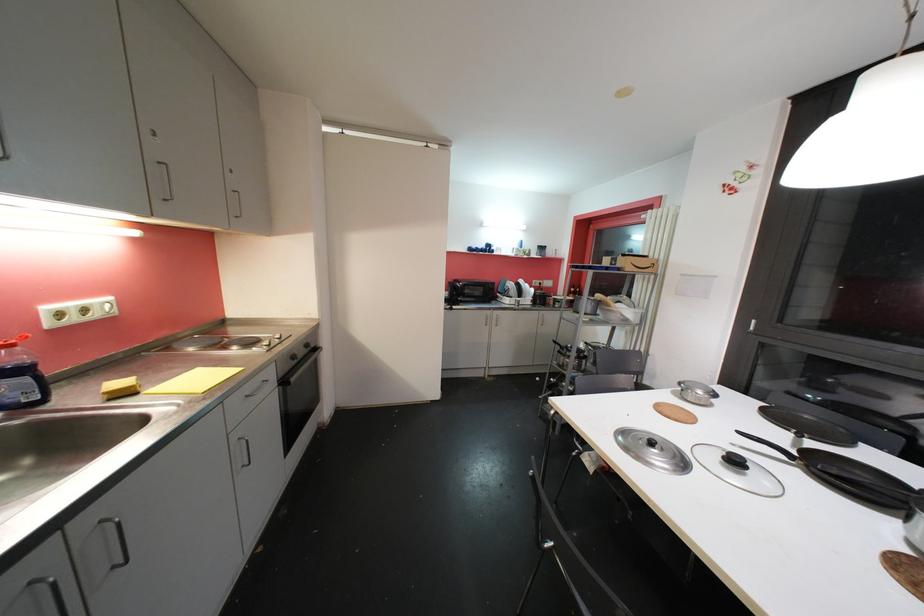
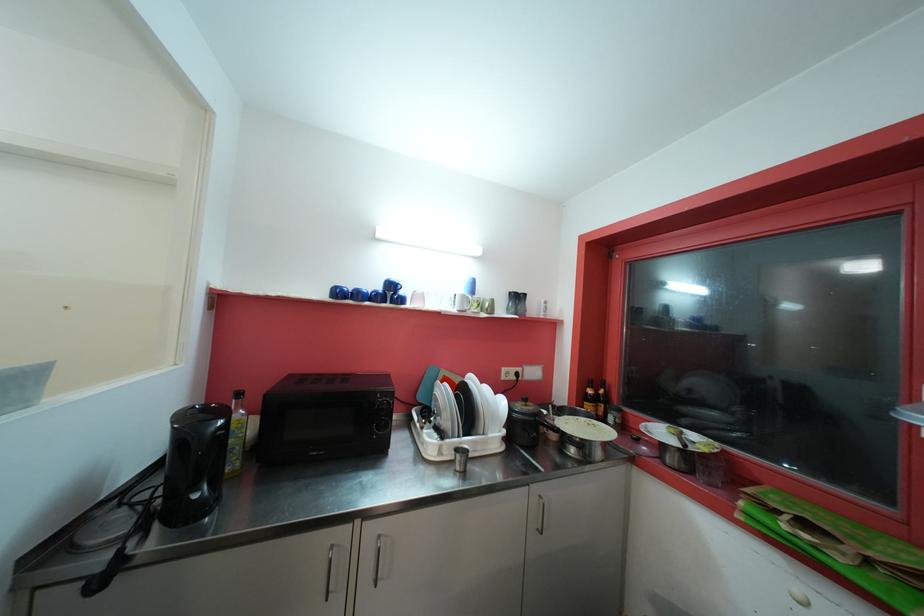
Question: Which direction would the cameraman need to move to produce the second image? Reply with the corresponding letter.

Choices:
 (A) Left
 (B) Right
 (C) Forward
 (D) Backward

Answer: (C)